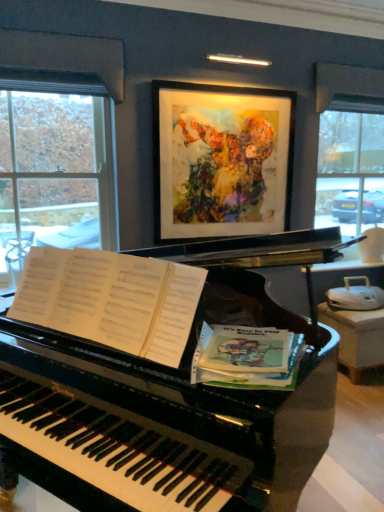
Question: Is green paper at piano right shorter than watercolor painting at upper center?

Choices:
 (A) yes
 (B) no

Answer: (A)

Question: From a real-world perspective, is green paper at piano right physically below watercolor painting at upper center?

Choices:
 (A) yes
 (B) no

Answer: (A)

Question: Is green paper at piano right positioned beyond the bounds of watercolor painting at upper center?

Choices:
 (A) yes
 (B) no

Answer: (A)

Question: Are green paper at piano right and watercolor painting at upper center located far from each other?

Choices:
 (A) yes
 (B) no

Answer: (A)

Question: From a real-world perspective, is green paper at piano right on watercolor painting at upper center?

Choices:
 (A) no
 (B) yes

Answer: (A)

Question: Does green paper at piano right lie in front of watercolor painting at upper center?

Choices:
 (A) no
 (B) yes

Answer: (B)

Question: From the image's perspective, is watercolor painting at upper center below green paper at piano right?

Choices:
 (A) no
 (B) yes

Answer: (A)

Question: From a real-world perspective, is watercolor painting at upper center positioned over green paper at piano right based on gravity?

Choices:
 (A) yes
 (B) no

Answer: (A)

Question: Does watercolor painting at upper center touch green paper at piano right?

Choices:
 (A) yes
 (B) no

Answer: (B)

Question: Is watercolor painting at upper center facing away from green paper at piano right?

Choices:
 (A) no
 (B) yes

Answer: (A)

Question: Does watercolor painting at upper center have a greater width compared to green paper at piano right?

Choices:
 (A) yes
 (B) no

Answer: (B)

Question: Is the position of watercolor painting at upper center less distant than that of green paper at piano right?

Choices:
 (A) no
 (B) yes

Answer: (A)

Question: Is clear glass window at left surrounded by green paper at piano right?

Choices:
 (A) yes
 (B) no

Answer: (B)